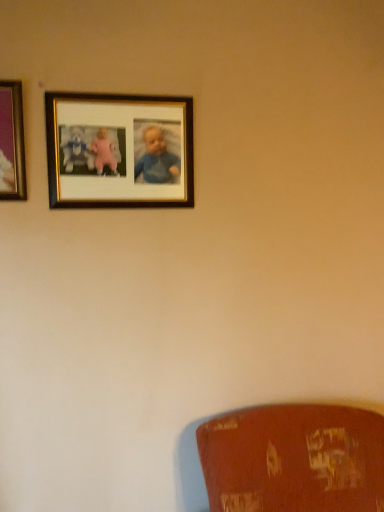
Image resolution: width=384 pixels, height=512 pixels. What do you see at coordinates (119, 150) in the screenshot?
I see `wooden photo frame at upper center, which ranks as the 2th picture frame in front-to-back order` at bounding box center [119, 150].

How much space does wooden photo frame at upper center, which ranks as the 2th picture frame in front-to-back order, occupy horizontally?

The width of wooden photo frame at upper center, which ranks as the 2th picture frame in front-to-back order, is 0.95 inches.

This screenshot has height=512, width=384. I want to click on wooden photo frame at upper center, which is the second picture frame from left to right, so (119, 150).

Image resolution: width=384 pixels, height=512 pixels. What do you see at coordinates (12, 142) in the screenshot?
I see `metallic silver frame at upper left, marked as the 2th picture frame in a back-to-front arrangement` at bounding box center [12, 142].

Locate an element on the screen. The image size is (384, 512). metallic silver frame at upper left, marked as the 2th picture frame in a back-to-front arrangement is located at coordinates coord(12,142).

Identify the location of wooden photo frame at upper center, which is the second picture frame from left to right. (119, 150).

Considering the relative positions of metallic silver frame at upper left, the second picture frame from the right, and wooden photo frame at upper center, which is the first picture frame from right to left, in the image provided, is metallic silver frame at upper left, the second picture frame from the right, to the right of wooden photo frame at upper center, which is the first picture frame from right to left, from the viewer's perspective?

No, metallic silver frame at upper left, the second picture frame from the right, is not to the right of wooden photo frame at upper center, which is the first picture frame from right to left.

Is metallic silver frame at upper left, the first picture frame positioned from the left, positioned before wooden photo frame at upper center, which is the second picture frame from left to right?

That is True.

Is point (8, 165) closer to camera compared to point (63, 95)?

That is True.

From the image's perspective, is metallic silver frame at upper left, marked as the 2th picture frame in a back-to-front arrangement, positioned above or below wooden photo frame at upper center, which is the second picture frame from left to right?

From the image's perspective, metallic silver frame at upper left, marked as the 2th picture frame in a back-to-front arrangement, appears above wooden photo frame at upper center, which is the second picture frame from left to right.

From a real-world perspective, is metallic silver frame at upper left, the first picture frame positioned from the left, above or below wooden photo frame at upper center, which ranks as the 2th picture frame in front-to-back order?

From a real-world perspective, metallic silver frame at upper left, the first picture frame positioned from the left, is physically above wooden photo frame at upper center, which ranks as the 2th picture frame in front-to-back order.

Considering the relative sizes of metallic silver frame at upper left, the second picture frame from the right, and wooden photo frame at upper center, which ranks as the 2th picture frame in front-to-back order, in the image provided, is metallic silver frame at upper left, the second picture frame from the right, thinner than wooden photo frame at upper center, which ranks as the 2th picture frame in front-to-back order,?

In fact, metallic silver frame at upper left, the second picture frame from the right, might be wider than wooden photo frame at upper center, which ranks as the 2th picture frame in front-to-back order.

Which of these two, metallic silver frame at upper left, marked as the first picture frame in a front-to-back arrangement, or wooden photo frame at upper center, which is the second picture frame from left to right, stands shorter?

metallic silver frame at upper left, marked as the first picture frame in a front-to-back arrangement.

Considering the sizes of metallic silver frame at upper left, marked as the 2th picture frame in a back-to-front arrangement, and wooden photo frame at upper center, which is the first picture frame from right to left, in the image, is metallic silver frame at upper left, marked as the 2th picture frame in a back-to-front arrangement, bigger or smaller than wooden photo frame at upper center, which is the first picture frame from right to left,?

Clearly, metallic silver frame at upper left, marked as the 2th picture frame in a back-to-front arrangement, is larger in size than wooden photo frame at upper center, which is the first picture frame from right to left.

Can we say metallic silver frame at upper left, marked as the first picture frame in a front-to-back arrangement, lies outside wooden photo frame at upper center, which ranks as the first picture frame in back-to-front order?

metallic silver frame at upper left, marked as the first picture frame in a front-to-back arrangement, is positioned outside wooden photo frame at upper center, which ranks as the first picture frame in back-to-front order.

Does metallic silver frame at upper left, marked as the 2th picture frame in a back-to-front arrangement, touch wooden photo frame at upper center, which is the second picture frame from left to right?

No, metallic silver frame at upper left, marked as the 2th picture frame in a back-to-front arrangement, is not beside wooden photo frame at upper center, which is the second picture frame from left to right.

Based on the photo, is metallic silver frame at upper left, marked as the first picture frame in a front-to-back arrangement, facing towards wooden photo frame at upper center, which ranks as the first picture frame in back-to-front order?

No, metallic silver frame at upper left, marked as the first picture frame in a front-to-back arrangement, is not facing towards wooden photo frame at upper center, which ranks as the first picture frame in back-to-front order.

How many degrees apart are the facing directions of metallic silver frame at upper left, the first picture frame positioned from the left, and wooden photo frame at upper center, which is the second picture frame from left to right?

metallic silver frame at upper left, the first picture frame positioned from the left, and wooden photo frame at upper center, which is the second picture frame from left to right, are facing 0.0105 degrees away from each other.

Find the location of a particular element. The height and width of the screenshot is (512, 384). picture frame located on the left of wooden photo frame at upper center, which is the second picture frame from left to right is located at coordinates (12, 142).

Would you say wooden photo frame at upper center, which ranks as the 2th picture frame in front-to-back order, is to the left or to the right of metallic silver frame at upper left, the first picture frame positioned from the left, in the picture?

wooden photo frame at upper center, which ranks as the 2th picture frame in front-to-back order, is positioned on metallic silver frame at upper left, the first picture frame positioned from the left,'s right side.

Considering their positions, is wooden photo frame at upper center, which is the first picture frame from right to left, located in front of or behind metallic silver frame at upper left, the second picture frame from the right?

Clearly, wooden photo frame at upper center, which is the first picture frame from right to left, is behind metallic silver frame at upper left, the second picture frame from the right.

Considering the points (155, 185) and (17, 156), which point is in front, point (155, 185) or point (17, 156)?

The point (17, 156) is closer.

From the image's perspective, is wooden photo frame at upper center, which is the first picture frame from right to left, located above metallic silver frame at upper left, marked as the 2th picture frame in a back-to-front arrangement?

No.

From a real-world perspective, between wooden photo frame at upper center, which is the first picture frame from right to left, and metallic silver frame at upper left, marked as the first picture frame in a front-to-back arrangement, who is vertically higher?

From a 3D spatial view, metallic silver frame at upper left, marked as the first picture frame in a front-to-back arrangement, is above.

Is wooden photo frame at upper center, which ranks as the first picture frame in back-to-front order, wider or thinner than metallic silver frame at upper left, the second picture frame from the right?

Clearly, wooden photo frame at upper center, which ranks as the first picture frame in back-to-front order, has less width compared to metallic silver frame at upper left, the second picture frame from the right.

Does wooden photo frame at upper center, which is the first picture frame from right to left, have a greater height compared to metallic silver frame at upper left, the first picture frame positioned from the left?

Correct, wooden photo frame at upper center, which is the first picture frame from right to left, is much taller as metallic silver frame at upper left, the first picture frame positioned from the left.

Considering the relative sizes of wooden photo frame at upper center, which ranks as the 2th picture frame in front-to-back order, and metallic silver frame at upper left, the first picture frame positioned from the left, in the image provided, is wooden photo frame at upper center, which ranks as the 2th picture frame in front-to-back order, bigger than metallic silver frame at upper left, the first picture frame positioned from the left,?

Actually, wooden photo frame at upper center, which ranks as the 2th picture frame in front-to-back order, might be smaller than metallic silver frame at upper left, the first picture frame positioned from the left.

Looking at this image, is wooden photo frame at upper center, which ranks as the first picture frame in back-to-front order, inside or outside of metallic silver frame at upper left, marked as the 2th picture frame in a back-to-front arrangement?

wooden photo frame at upper center, which ranks as the first picture frame in back-to-front order, is outside metallic silver frame at upper left, marked as the 2th picture frame in a back-to-front arrangement.

Is wooden photo frame at upper center, which is the first picture frame from right to left, touching metallic silver frame at upper left, marked as the first picture frame in a front-to-back arrangement?

No, wooden photo frame at upper center, which is the first picture frame from right to left, is not in contact with metallic silver frame at upper left, marked as the first picture frame in a front-to-back arrangement.

Is wooden photo frame at upper center, which is the second picture frame from left to right, facing away from metallic silver frame at upper left, marked as the first picture frame in a front-to-back arrangement?

No, wooden photo frame at upper center, which is the second picture frame from left to right,'s orientation is not away from metallic silver frame at upper left, marked as the first picture frame in a front-to-back arrangement.

What's the angular difference between wooden photo frame at upper center, which ranks as the 2th picture frame in front-to-back order, and metallic silver frame at upper left, marked as the first picture frame in a front-to-back arrangement,'s facing directions?

The facing directions of wooden photo frame at upper center, which ranks as the 2th picture frame in front-to-back order, and metallic silver frame at upper left, marked as the first picture frame in a front-to-back arrangement, are 0.0105 degrees apart.

I want to click on picture frame on the left of wooden photo frame at upper center, which ranks as the 2th picture frame in front-to-back order, so 12,142.

Where is `picture frame below the metallic silver frame at upper left, marked as the 2th picture frame in a back-to-front arrangement (from the image's perspective)`? Image resolution: width=384 pixels, height=512 pixels. picture frame below the metallic silver frame at upper left, marked as the 2th picture frame in a back-to-front arrangement (from the image's perspective) is located at coordinates (119, 150).

Image resolution: width=384 pixels, height=512 pixels. I want to click on picture frame that is behind the metallic silver frame at upper left, the second picture frame from the right, so click(119, 150).